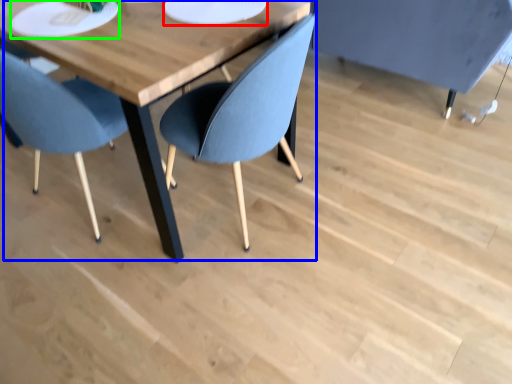
Question: Considering the real-world distances, which object is closest to paper plate (highlighted by a red box)? table (highlighted by a blue box) or platter (highlighted by a green box).

Choices:
 (A) table
 (B) platter

Answer: (A)